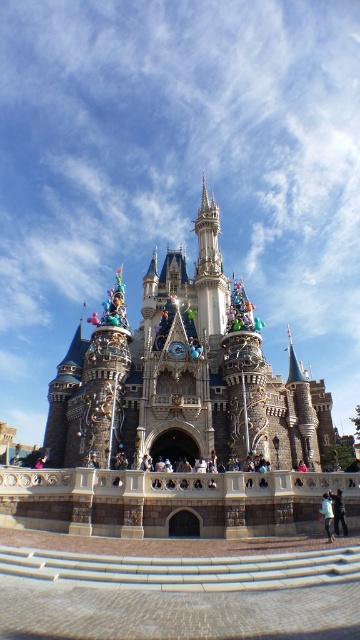
You are a photographer planning to take a photo of the light blue denim jeans at lower right and the light blue denim jacket at lower right. Since you want to ensure both items are clearly visible in the frame, which object should you focus on to account for their sizes?

The light blue denim jeans at lower right has a larger width than the light blue denim jacket at lower right, so focusing on the light blue denim jeans at lower right would ensure both items are clearly visible in the frame.

You are standing in front of the stone castle at center and see the light blue denim jeans at lower right. Which object is positioned higher from the ground?

The stone castle at center is located above the light blue denim jeans at lower right, so it is positioned higher from the ground.